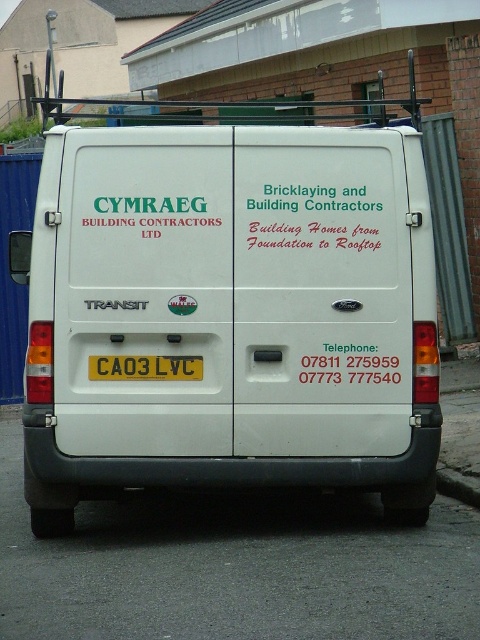
Is white matte van at center to the right of yellow matte license plate at center from the viewer's perspective?

Yes, white matte van at center is to the right of yellow matte license plate at center.

Is white matte van at center to the left of yellow matte license plate at center from the viewer's perspective?

No, white matte van at center is not to the left of yellow matte license plate at center.

Describe the element at coordinates (230, 314) in the screenshot. I see `white matte van at center` at that location.

Find the location of `white matte van at center`. white matte van at center is located at coordinates (230, 314).

Can you confirm if white matte van at center is positioned below gray concrete curb at lower right?

Actually, white matte van at center is above gray concrete curb at lower right.

Who is more forward, (269, 312) or (460, 483)?

Point (269, 312) is in front.

Measure the distance between point (433, 355) and camera.

Point (433, 355) and camera are 6.32 meters apart from each other.

At what (x,y) coordinates should I click in order to perform the action: click on white matte van at center. Please return your answer as a coordinate pair (x, y). Looking at the image, I should click on (230, 314).

Is yellow matte license plate at center to the right of gray concrete curb at lower right from the viewer's perspective?

In fact, yellow matte license plate at center is to the left of gray concrete curb at lower right.

Is yellow matte license plate at center closer to camera compared to gray concrete curb at lower right?

Yes, it is.

Does point (134, 364) lie behind point (439, 481)?

No, it is not.

Where is `yellow matte license plate at center`? This screenshot has height=640, width=480. yellow matte license plate at center is located at coordinates (144, 368).